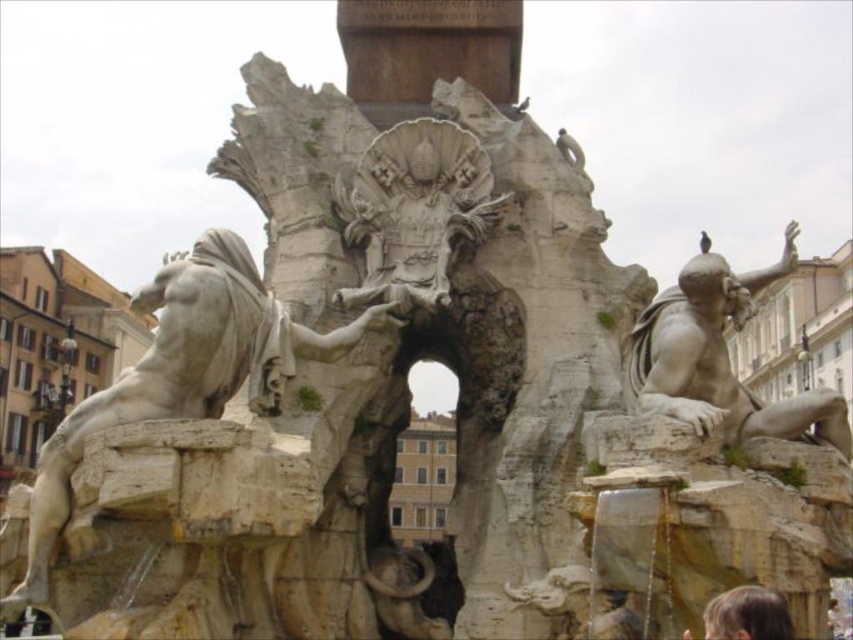
Question: Which point appears farthest from the camera in this image?

Choices:
 (A) (273, 381)
 (B) (393, 304)

Answer: (B)

Question: Is white marble statue at center further to the viewer compared to white stone sculpture at center?

Choices:
 (A) yes
 (B) no

Answer: (B)

Question: Among these objects, which one is nearest to the camera?

Choices:
 (A) matte stone figure at right
 (B) white marble statue at center
 (C) white stone sculpture at center

Answer: (B)

Question: Is white marble statue at center to the right of white stone sculpture at center from the viewer's perspective?

Choices:
 (A) no
 (B) yes

Answer: (A)

Question: Which point appears farthest from the camera in this image?

Choices:
 (A) (164, 394)
 (B) (401, 131)

Answer: (B)

Question: Can you confirm if white stone sculpture at center is smaller than matte stone figure at right?

Choices:
 (A) no
 (B) yes

Answer: (B)